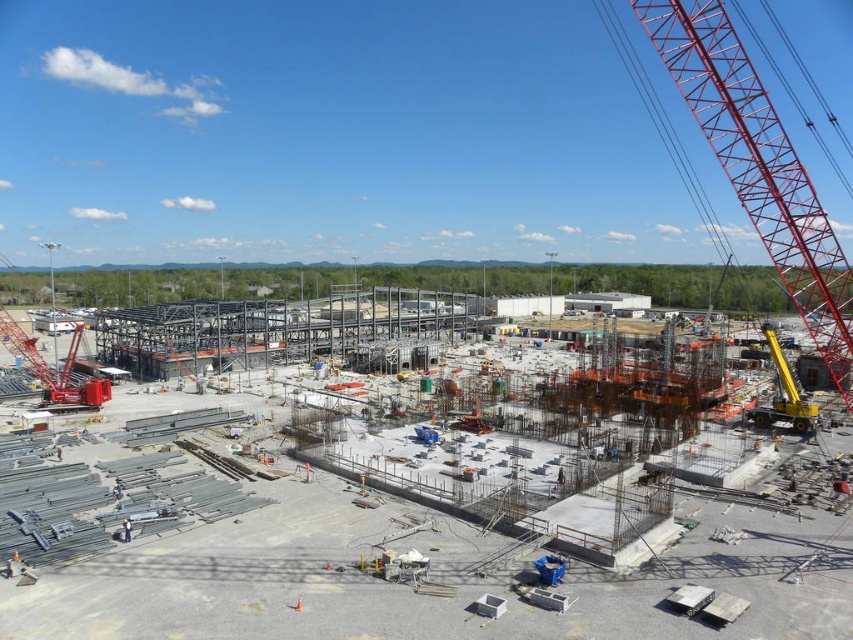
Question: Estimate the real-world distances between objects in this image. Which object is farther from the metallic red crane at left?

Choices:
 (A) gray metallic structure at center
 (B) yellow metallic crane at right

Answer: (B)

Question: Which of these objects is positioned farthest from the gray metallic structure at center?

Choices:
 (A) yellow metallic crane at right
 (B) metallic red crane at left
 (C) metallic red crane at upper right

Answer: (A)

Question: Where is gray metallic structure at center located in relation to metallic red crane at upper right in the image?

Choices:
 (A) below
 (B) above

Answer: (A)

Question: Does gray metallic structure at center have a lesser width compared to metallic red crane at left?

Choices:
 (A) no
 (B) yes

Answer: (A)

Question: Among these points, which one is nearest to the camera?

Choices:
 (A) (761, 170)
 (B) (801, 432)

Answer: (A)

Question: Does metallic red crane at left have a greater width compared to yellow metallic crane at right?

Choices:
 (A) no
 (B) yes

Answer: (B)